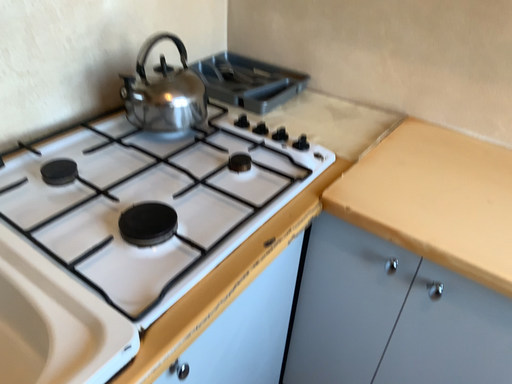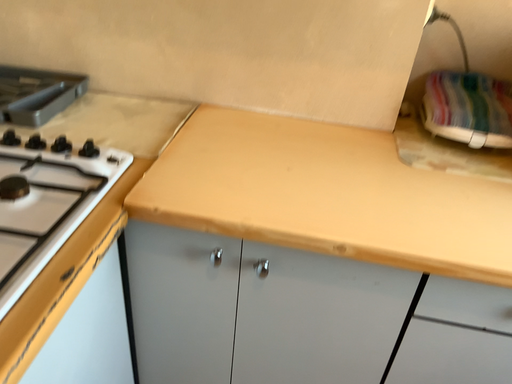
Question: How did the camera likely rotate when shooting the video?

Choices:
 (A) rotated left
 (B) rotated right

Answer: (B)